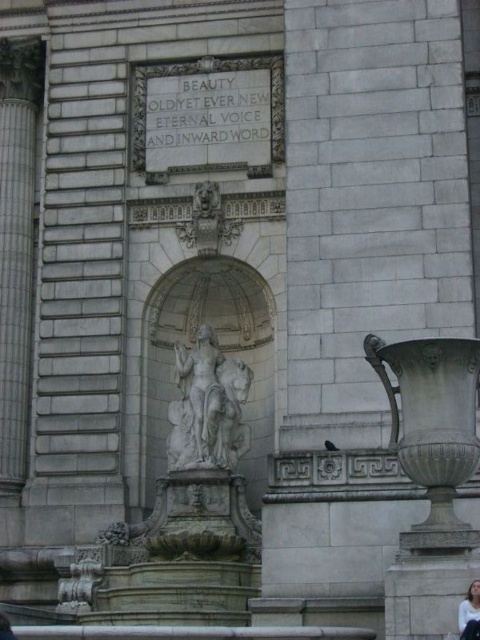
Question: Which point is farther to the camera?

Choices:
 (A) (466, 612)
 (B) (189, 349)

Answer: (B)

Question: Which object appears closest to the camera in this image?

Choices:
 (A) white marble statue at center
 (B) white fabric at lower right

Answer: (B)

Question: Can you confirm if white marble statue at center is positioned to the left of white fabric at lower right?

Choices:
 (A) no
 (B) yes

Answer: (B)

Question: Does white marble statue at center appear on the right side of white fabric at lower right?

Choices:
 (A) no
 (B) yes

Answer: (A)

Question: Can you confirm if white marble statue at center is smaller than white fabric at lower right?

Choices:
 (A) yes
 (B) no

Answer: (A)